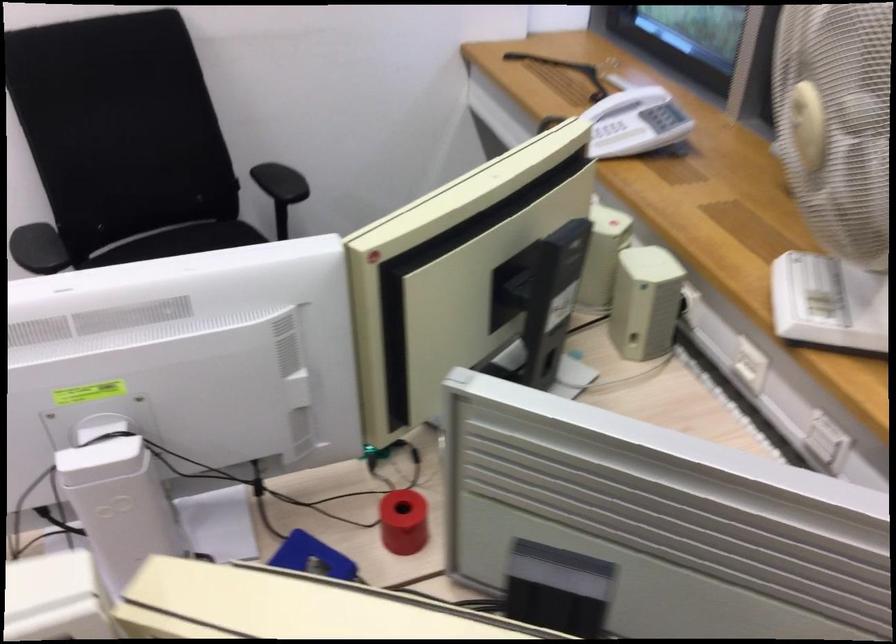
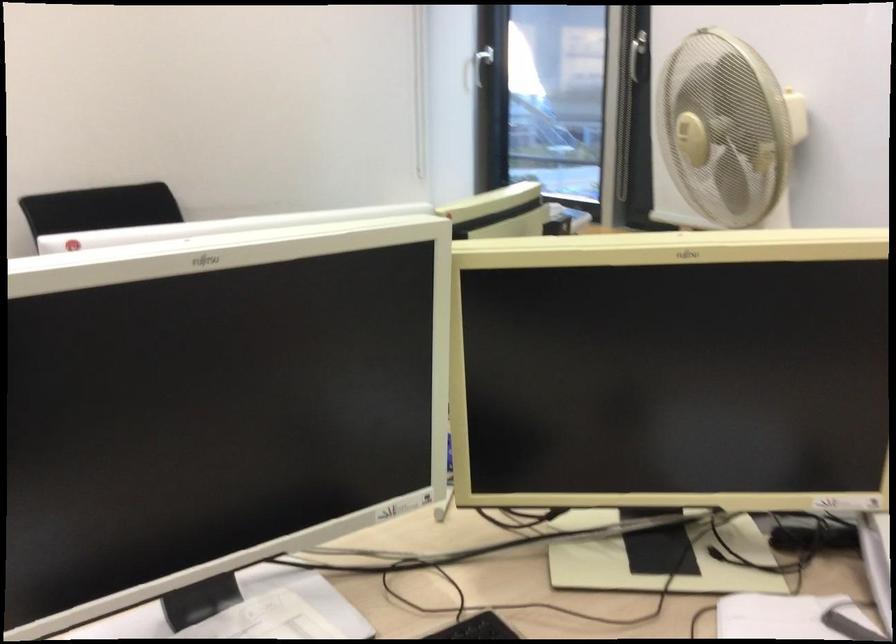
Question: I am providing you with two images of the same scene from different viewpoints. After the viewpoint changes to image2, which objects are now occluded?

Choices:
 (A) white window handle
 (B) beige computer speaker
 (C) metal hanger hook
 (D) fan control knob

Answer: (B)